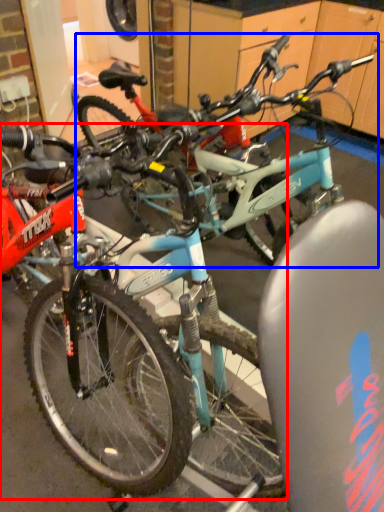
Question: Which object is closer to the camera taking this photo, bicycle (highlighted by a red box) or bicycle (highlighted by a blue box)?

Choices:
 (A) bicycle
 (B) bicycle

Answer: (A)